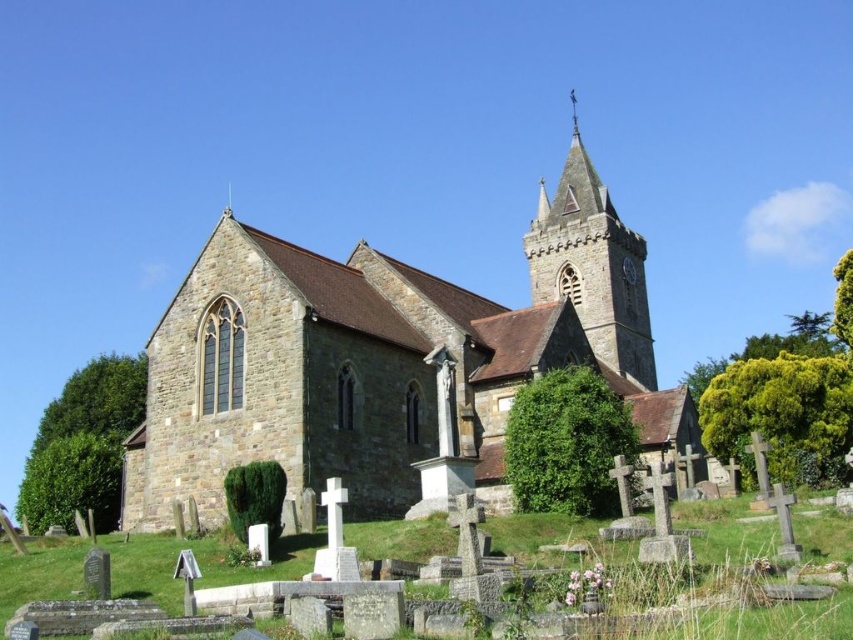
Question: Which point is closer to the camera?

Choices:
 (A) brown stone church at center
 (B) stone steeple at upper center

Answer: (A)

Question: Does brown stone church at center have a smaller size compared to stone steeple at upper center?

Choices:
 (A) no
 (B) yes

Answer: (A)

Question: Observing the image, what is the correct spatial positioning of brown stone church at center in reference to stone steeple at upper center?

Choices:
 (A) right
 (B) left

Answer: (B)

Question: Does brown stone church at center have a larger size compared to stone steeple at upper center?

Choices:
 (A) yes
 (B) no

Answer: (A)

Question: Which point is closer to the camera?

Choices:
 (A) brown stone church at center
 (B) stone steeple at upper center

Answer: (A)